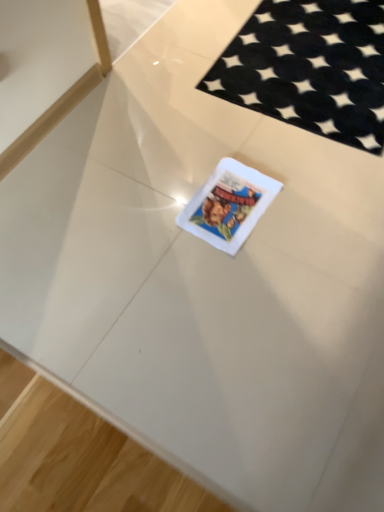
This screenshot has height=512, width=384. Find the location of `black felt mat at upper right`. black felt mat at upper right is located at coordinates (310, 68).

This screenshot has height=512, width=384. What do you see at coordinates (310, 68) in the screenshot? I see `black felt mat at upper right` at bounding box center [310, 68].

What do you see at coordinates (228, 205) in the screenshot? I see `white matte card at center` at bounding box center [228, 205].

This screenshot has height=512, width=384. Find the location of `white matte card at center`. white matte card at center is located at coordinates (228, 205).

In order to face white matte card at center, should I rotate leftwards or rightwards?

It's best to rotate right around 5.193 degrees.

Image resolution: width=384 pixels, height=512 pixels. I want to click on black felt mat at upper right, so click(x=310, y=68).

Based on their positions, is black felt mat at upper right located to the left or right of white matte card at center?

black felt mat at upper right is positioned on white matte card at center's right side.

Which object is closer to the camera taking this photo, black felt mat at upper right or white matte card at center?

white matte card at center is closer to the camera.

Which is closer to the camera, (303, 6) or (243, 222)?

Point (303, 6).

From the image's perspective, is black felt mat at upper right positioned above or below white matte card at center?

black felt mat at upper right is above white matte card at center.

From a real-world perspective, is black felt mat at upper right positioned over white matte card at center based on gravity?

Actually, black felt mat at upper right is physically below white matte card at center in the real world.

Is black felt mat at upper right wider or thinner than white matte card at center?

black felt mat at upper right is wider than white matte card at center.

Which of these two, black felt mat at upper right or white matte card at center, stands taller?

white matte card at center is taller.

Does black felt mat at upper right have a smaller size compared to white matte card at center?

Actually, black felt mat at upper right might be larger than white matte card at center.

Would you say black felt mat at upper right is outside white matte card at center?

Indeed, black felt mat at upper right is completely outside white matte card at center.

Is black felt mat at upper right far from white matte card at center?

No, black felt mat at upper right is not far away from white matte card at center.

Is black felt mat at upper right positioned with its back to white matte card at center?

black felt mat at upper right is not turned away from white matte card at center.

How far apart are black felt mat at upper right and white matte card at center?

black felt mat at upper right and white matte card at center are 19.63 inches apart from each other.

You are a GUI agent. You are given a task and a screenshot of the screen. Output one action in this format:
    pyautogui.click(x=<x>, y=<y>)
    Task: Click on the mat below the white matte card at center (from a real-world perspective)
    The height and width of the screenshot is (512, 384).
    Given the screenshot: What is the action you would take?
    pyautogui.click(x=310, y=68)

Does white matte card at center appear on the right side of black felt mat at upper right?

No, white matte card at center is not to the right of black felt mat at upper right.

Is white matte card at center in front of black felt mat at upper right?

Yes, white matte card at center is closer to the viewer.

Which point is more distant from viewer, (214, 210) or (332, 77)?

Positioned behind is point (332, 77).

From the image's perspective, would you say white matte card at center is positioned over black felt mat at upper right?

Incorrect, from the image's perspective, white matte card at center is lower than black felt mat at upper right.

From a real-world perspective, is white matte card at center over black felt mat at upper right?

Yes.

Is white matte card at center thinner than black felt mat at upper right?

Correct, the width of white matte card at center is less than that of black felt mat at upper right.

Can you confirm if white matte card at center is shorter than black felt mat at upper right?

No.

Considering the sizes of objects white matte card at center and black felt mat at upper right in the image provided, who is smaller, white matte card at center or black felt mat at upper right?

Smaller between the two is white matte card at center.

Is white matte card at center positioned beyond the bounds of black felt mat at upper right?

Absolutely, white matte card at center is external to black felt mat at upper right.

Is white matte card at center with black felt mat at upper right?

No, white matte card at center is not in contact with black felt mat at upper right.

Is white matte card at center facing towards black felt mat at upper right?

No, white matte card at center is not turned towards black felt mat at upper right.

What's the angular difference between white matte card at center and black felt mat at upper right's facing directions?

They differ by 5.01 degrees in their facing directions.

Measure the distance between white matte card at center and black felt mat at upper right.

white matte card at center is 19.63 inches away from black felt mat at upper right.

Where is `birthday card that appears in front of the black felt mat at upper right`? The image size is (384, 512). birthday card that appears in front of the black felt mat at upper right is located at coordinates (228, 205).

Find the location of a particular element. Image resolution: width=384 pixels, height=512 pixels. mat that appears on the right of white matte card at center is located at coordinates (310, 68).

Identify the location of birthday card on the left of black felt mat at upper right. point(228,205).